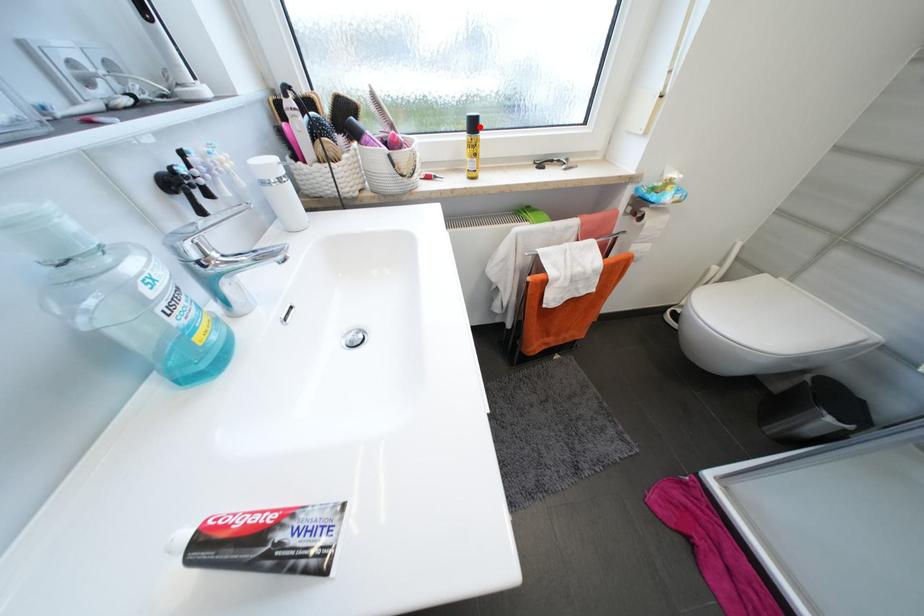
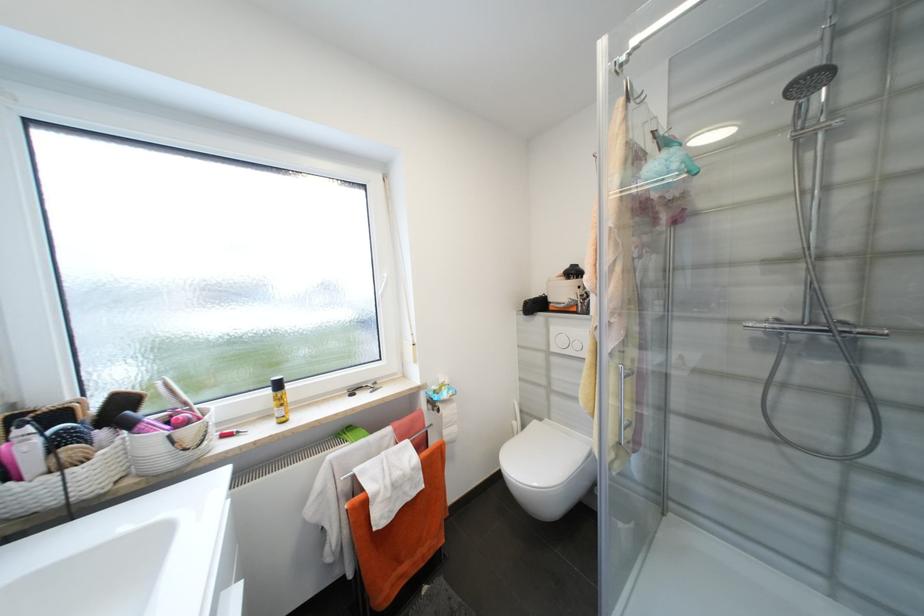
Question: I am providing you with two images of the same scene from different viewpoints. Given a red point in image1, look at the same physical point in image2. Is it:

Choices:
 (A) Closer to the viewpoint
 (B) Farther from the viewpoint

Answer: (B)